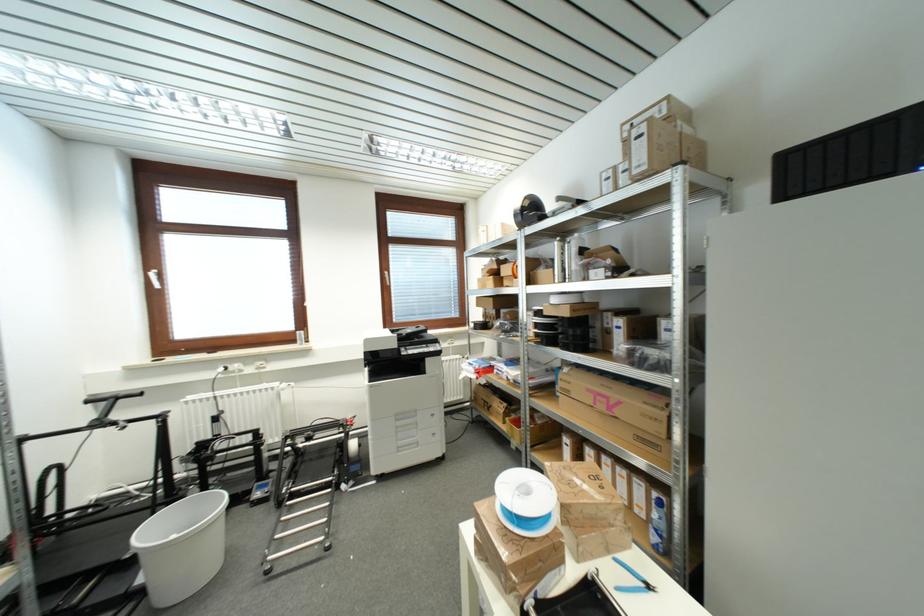
Describe the element at coordinates (704, 240) in the screenshot. I see `a metal cabinet handle` at that location.